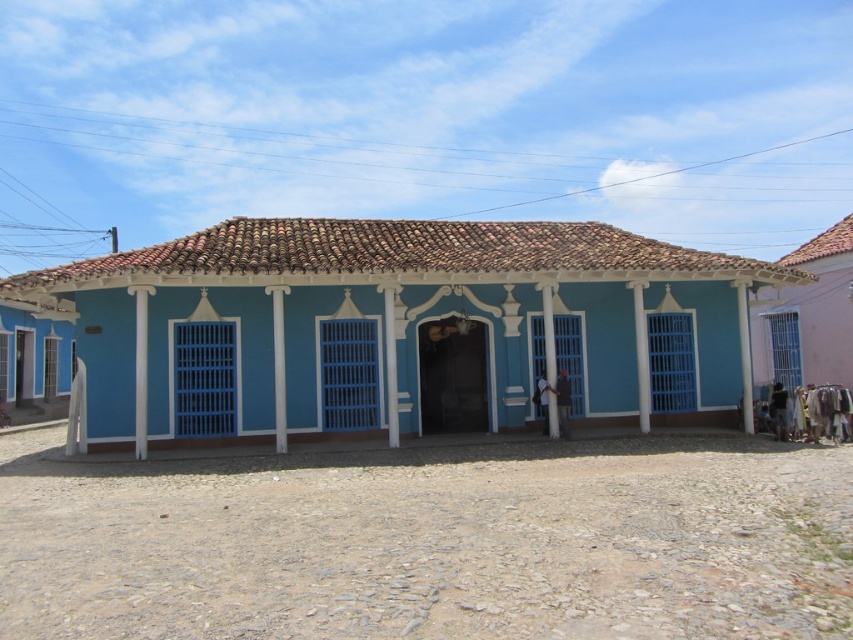
You are standing in front of the blue painted wood house at center and want to take a photo of the pink fabric at right. Which object should you focus on first to ensure both are in the frame?

The blue painted wood house at center is not as tall as the pink fabric at right, so you should focus on the pink fabric at right first to ensure both are in the frame.

You are standing at the point with coordinates point (397, 326). Based on the scene description, what is the closest object to you?

The point (397, 326) corresponds to the blue painted wood house at center, so the closest object to you is the blue painted wood house at center.